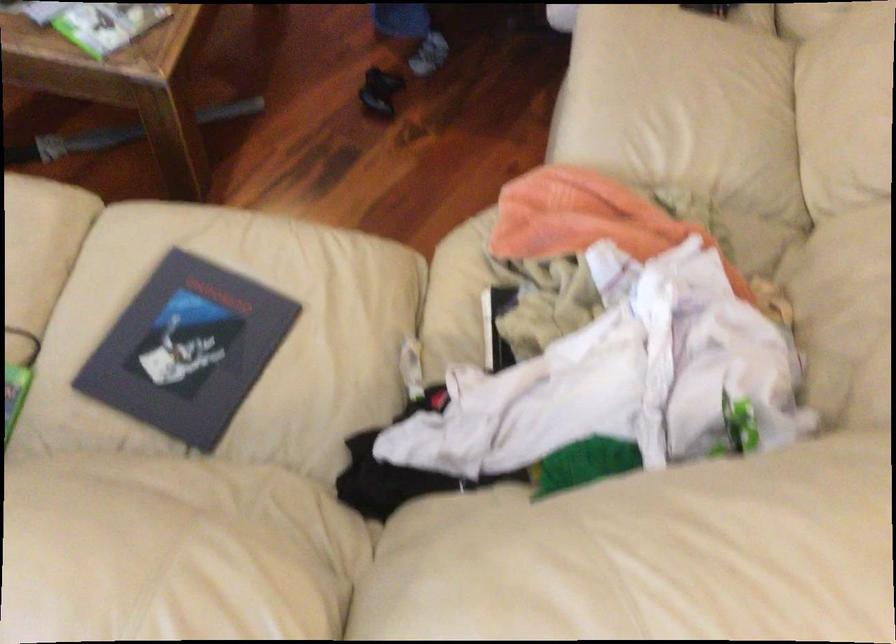
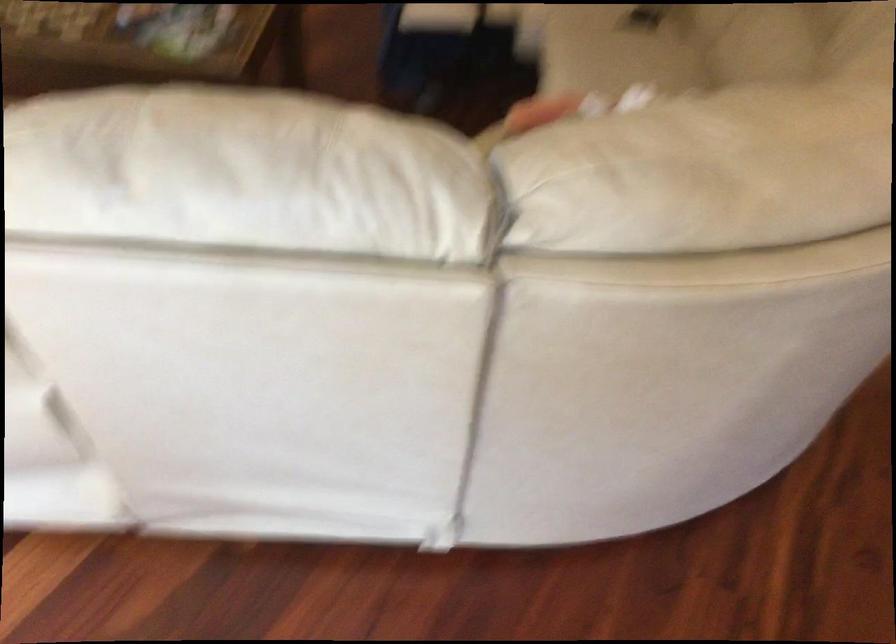
Find the pixel in the second image that matches pixel 659 82 in the first image.

(616, 49)